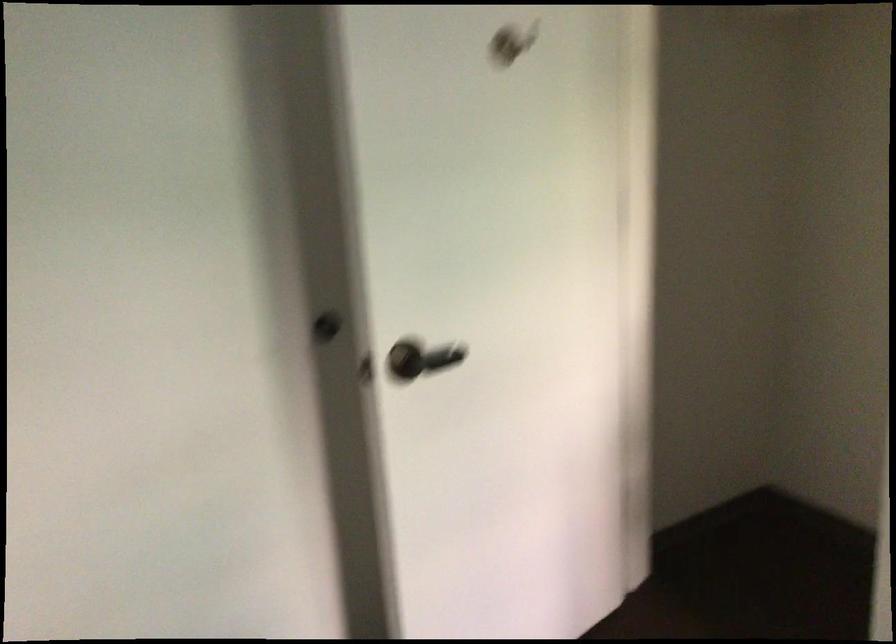
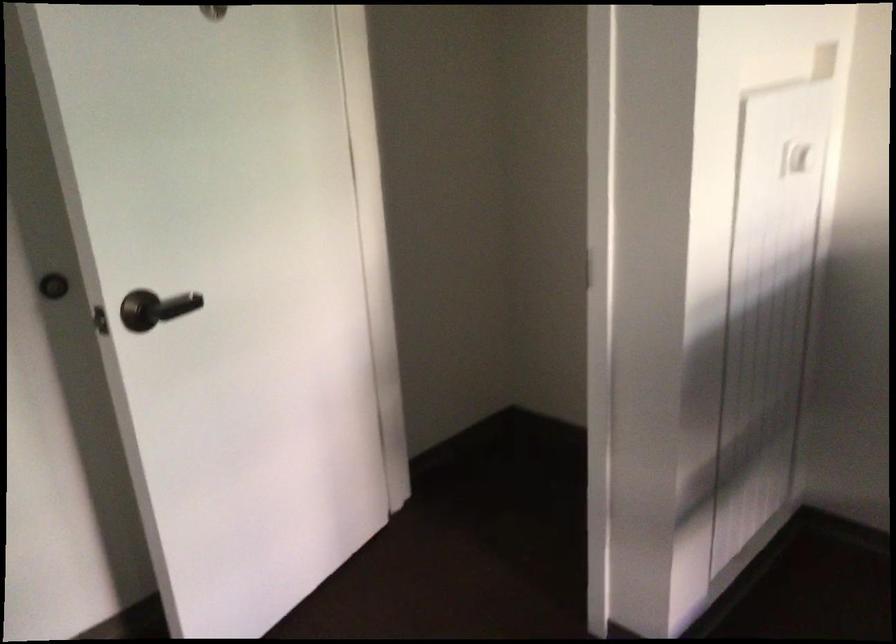
Consider the image. In a continuous first-person perspective shot, in which direction is the camera moving?

The cameraman moved toward right, backward.